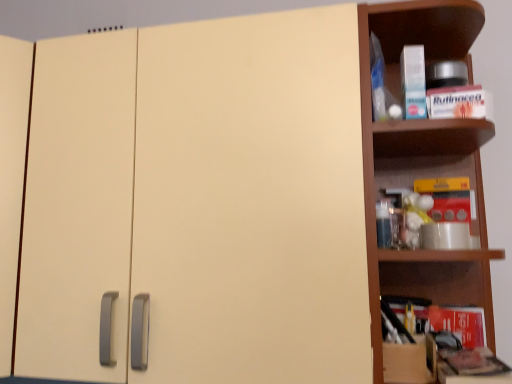
This screenshot has height=384, width=512. What do you see at coordinates (252, 200) in the screenshot?
I see `matte cream cabinet at center` at bounding box center [252, 200].

Measure the distance between point (388, 18) and camera.

The distance of point (388, 18) from camera is 33.74 inches.

The height and width of the screenshot is (384, 512). I want to click on matte cream cabinet at center, so click(252, 200).

Considering the sizes of objects brown wooden shelf at right and cardboard box at right in the image provided, who is thinner, brown wooden shelf at right or cardboard box at right?

With smaller width is cardboard box at right.

Can you tell me how much brown wooden shelf at right and cardboard box at right differ in facing direction?

They differ by 3.49 degrees in their facing directions.

Which is behind, brown wooden shelf at right or cardboard box at right?

Positioned behind is cardboard box at right.

Visually, is brown wooden shelf at right positioned to the left or to the right of cardboard box at right?

In the image, brown wooden shelf at right appears on the right side of cardboard box at right.

What's the angular difference between brown wooden shelf at right and matte cream cabinet at center's facing directions?

The angular difference between brown wooden shelf at right and matte cream cabinet at center is 0.000986 degrees.

Is brown wooden shelf at right placed right next to matte cream cabinet at center?

No, brown wooden shelf at right is not beside matte cream cabinet at center.

Is brown wooden shelf at right aimed at matte cream cabinet at center?

No, brown wooden shelf at right is not aimed at matte cream cabinet at center.

Would you say brown wooden shelf at right is outside matte cream cabinet at center?

Yes.

Is cardboard box at right far from brown wooden shelf at right?

That's not correct — cardboard box at right is a little close to brown wooden shelf at right.

Does cardboard box at right appear on the right side of brown wooden shelf at right?

No, cardboard box at right is not to the right of brown wooden shelf at right.

Which is in front, cardboard box at right or brown wooden shelf at right?

brown wooden shelf at right.

Does point (404, 350) come behind point (376, 5)?

No, (404, 350) is in front of (376, 5).

Is matte cream cabinet at center placed right next to brown wooden shelf at right?

No, matte cream cabinet at center is not with brown wooden shelf at right.

The image size is (512, 384). Find the location of `door in front of the brown wooden shelf at right`. door in front of the brown wooden shelf at right is located at coordinates (252, 200).

Considering the relative positions of matte cream cabinet at center and brown wooden shelf at right in the image provided, is matte cream cabinet at center to the left or to the right of brown wooden shelf at right?

Clearly, matte cream cabinet at center is on the left of brown wooden shelf at right in the image.

Which of these two, matte cream cabinet at center or brown wooden shelf at right, is bigger?

matte cream cabinet at center.

From a real-world perspective, between matte cream cabinet at center and cardboard box at right, who is vertically lower?

From a 3D spatial view, cardboard box at right is below.

Is point (246, 366) more distant than point (391, 356)?

That is False.

Between cardboard box at right and matte cream cabinet at center, which one has less height?

cardboard box at right.

How far apart are cardboard box at right and matte cream cabinet at center?

cardboard box at right is 14.52 inches away from matte cream cabinet at center.

From the picture: Between cardboard box at right and matte cream cabinet at center, which one appears on the right side from the viewer's perspective?

cardboard box at right.

The width and height of the screenshot is (512, 384). Find the location of `shelf located above the cardboard box at right (from a real-world perspective)`. shelf located above the cardboard box at right (from a real-world perspective) is located at coordinates (423, 157).

At what (x,y) coordinates should I click in order to perform the action: click on door below the brown wooden shelf at right (from a real-world perspective). Please return your answer as a coordinate pair (x, y). Looking at the image, I should click on (252, 200).

Which object lies further to the anchor point matte cream cabinet at center, brown wooden shelf at right or cardboard box at right?

Among the two, cardboard box at right is located further to matte cream cabinet at center.

Which object lies nearer to the anchor point cardboard box at right, brown wooden shelf at right or matte cream cabinet at center?

The object closer to cardboard box at right is brown wooden shelf at right.

Considering their positions, is matte cream cabinet at center positioned closer to brown wooden shelf at right than cardboard box at right?

Based on the image, matte cream cabinet at center appears to be nearer to brown wooden shelf at right.

Looking at the image, which one is located further to brown wooden shelf at right, cardboard box at right or matte cream cabinet at center?

cardboard box at right is further to brown wooden shelf at right.

Considering their positions, is cardboard box at right positioned further to matte cream cabinet at center than brown wooden shelf at right?

cardboard box at right.

Considering their positions, is matte cream cabinet at center positioned closer to cardboard box at right than brown wooden shelf at right?

brown wooden shelf at right is closer to cardboard box at right.

The image size is (512, 384). In order to click on cardboard box between matte cream cabinet at center and brown wooden shelf at right in the horizontal direction in this screenshot , I will do `click(409, 361)`.